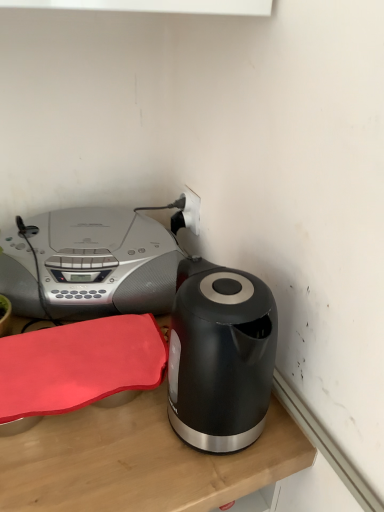
Question: Is wooden table at lower left not close to satin silver stereo at upper left?

Choices:
 (A) yes
 (B) no

Answer: (B)

Question: Does wooden table at lower left have a lesser height compared to satin silver stereo at upper left?

Choices:
 (A) yes
 (B) no

Answer: (A)

Question: Does wooden table at lower left come behind satin silver stereo at upper left?

Choices:
 (A) no
 (B) yes

Answer: (A)

Question: Considering the relative sizes of wooden table at lower left and satin silver stereo at upper left in the image provided, is wooden table at lower left bigger than satin silver stereo at upper left?

Choices:
 (A) no
 (B) yes

Answer: (A)

Question: Considering the relative positions of wooden table at lower left and satin silver stereo at upper left in the image provided, is wooden table at lower left to the left of satin silver stereo at upper left from the viewer's perspective?

Choices:
 (A) no
 (B) yes

Answer: (A)

Question: From the image's perspective, does wooden table at lower left appear higher than satin silver stereo at upper left?

Choices:
 (A) no
 (B) yes

Answer: (A)

Question: From a real-world perspective, is white plastic plug at upper center physically above satin silver stereo at upper left?

Choices:
 (A) yes
 (B) no

Answer: (A)

Question: Considering the relative sizes of white plastic plug at upper center and satin silver stereo at upper left in the image provided, is white plastic plug at upper center taller than satin silver stereo at upper left?

Choices:
 (A) yes
 (B) no

Answer: (B)

Question: Can we say white plastic plug at upper center lies outside satin silver stereo at upper left?

Choices:
 (A) no
 (B) yes

Answer: (B)

Question: From a real-world perspective, does white plastic plug at upper center sit lower than satin silver stereo at upper left?

Choices:
 (A) yes
 (B) no

Answer: (B)

Question: From the image's perspective, would you say white plastic plug at upper center is shown under satin silver stereo at upper left?

Choices:
 (A) no
 (B) yes

Answer: (A)

Question: Can you confirm if white plastic plug at upper center is positioned to the left of satin silver stereo at upper left?

Choices:
 (A) yes
 (B) no

Answer: (B)

Question: Is the depth of satin silver stereo at upper left less than that of wooden table at lower left?

Choices:
 (A) no
 (B) yes

Answer: (A)